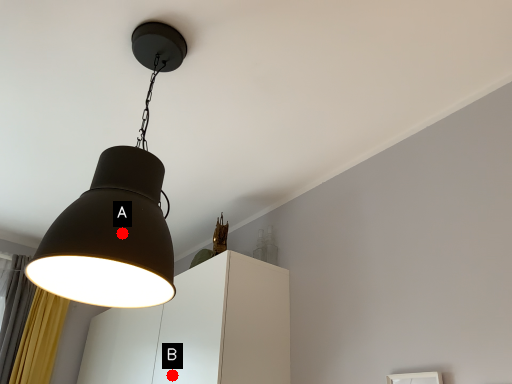
Question: Two points are circled on the image, labeled by A and B beside each circle. Among these points, which one is nearest to the camera?

Choices:
 (A) A is closer
 (B) B is closer

Answer: (A)